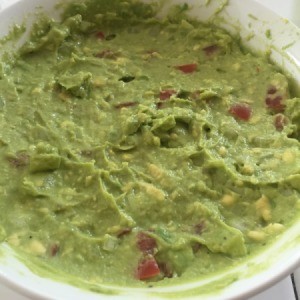
Locate an element on the screen. white surface is located at coordinates (285, 289).